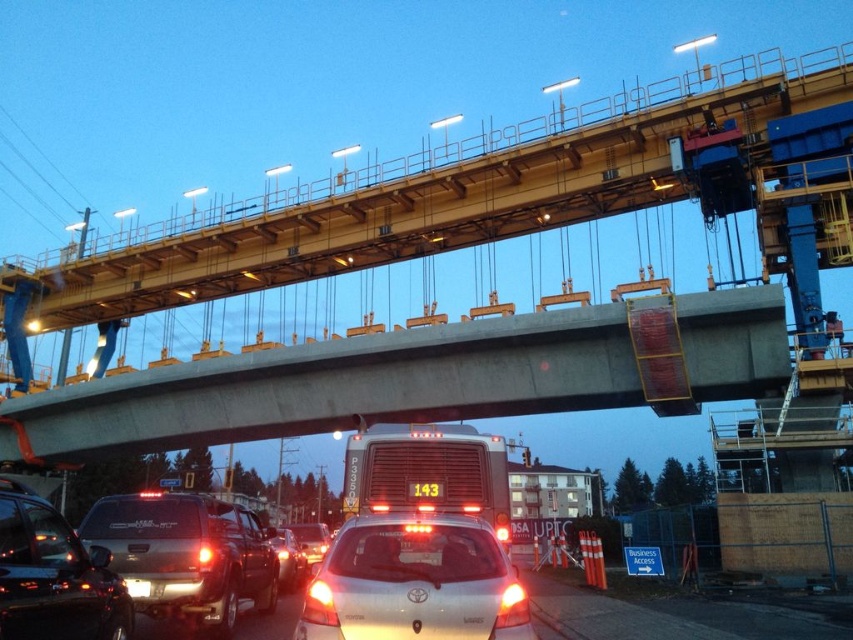
Question: Observing the image, what is the correct spatial positioning of matte black suv at center in reference to matte black trailer truck at center?

Choices:
 (A) left
 (B) right

Answer: (A)

Question: Does satin black suv at lower left have a larger size compared to shiny silver sedan at center?

Choices:
 (A) yes
 (B) no

Answer: (A)

Question: Which point is farther to the camera?

Choices:
 (A) (45, 515)
 (B) (61, 266)
 (C) (323, 532)
 (D) (289, 566)

Answer: (B)

Question: Which object is positioned closest to the white plastic license plate at center?

Choices:
 (A) matte black trailer truck at center
 (B) concrete at center
 (C) matte black suv at center

Answer: (A)

Question: Which of the following is the farthest from the observer?

Choices:
 (A) (30, 608)
 (B) (430, 481)
 (C) (321, 524)

Answer: (C)

Question: Does satin black suv at lower left appear over shiny silver sedan at center?

Choices:
 (A) yes
 (B) no

Answer: (A)